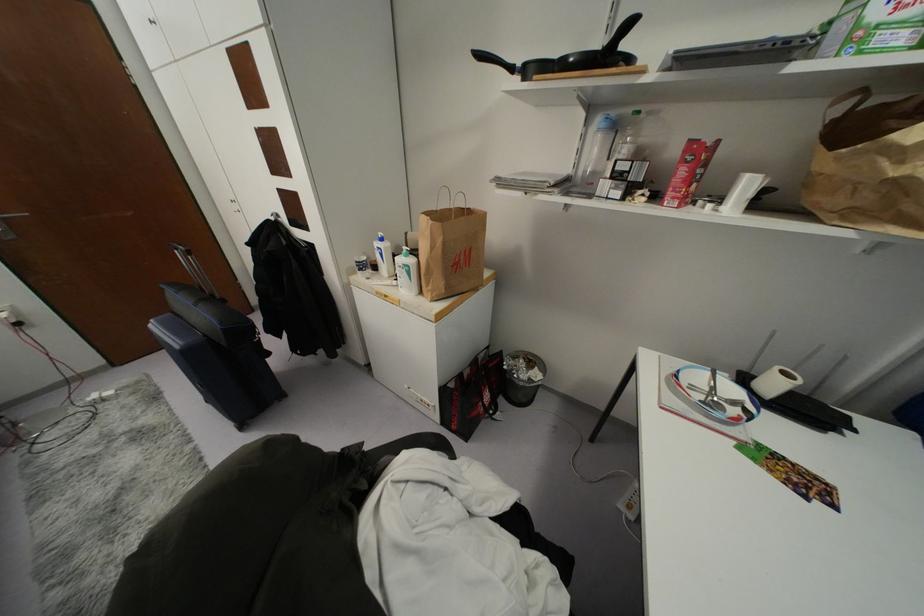
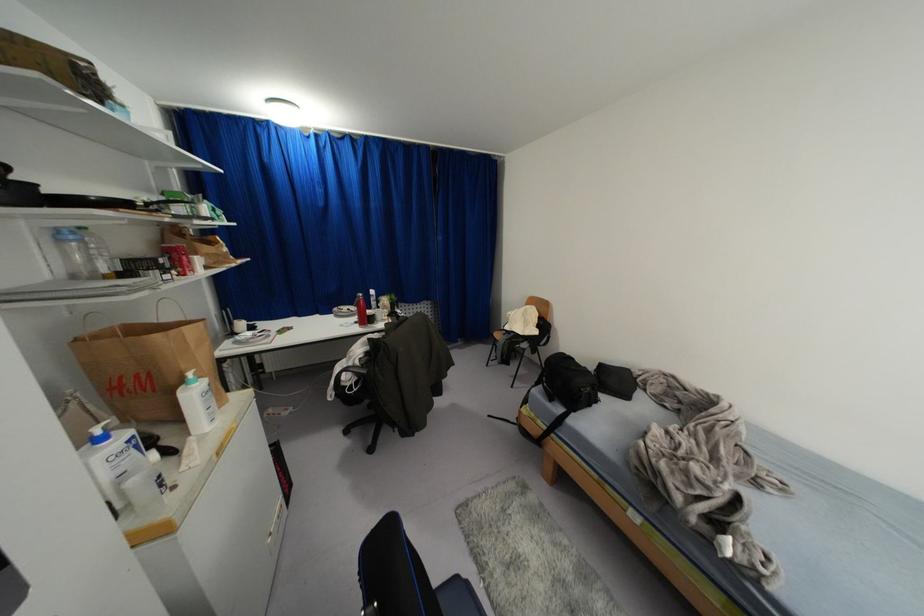
In the second image, find the point that corresponds to the point at 599,130 in the first image.

(62, 240)